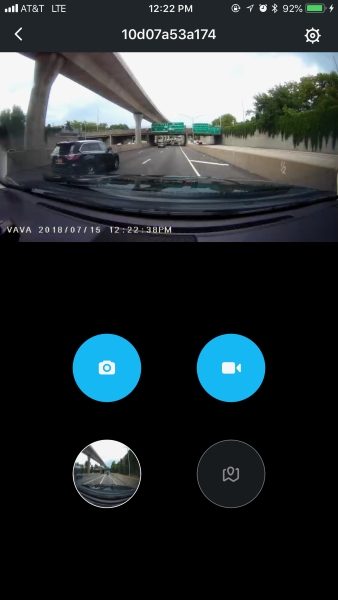
This screenshot has width=338, height=600. What are the coordinates of `pillar` in the screenshot? It's located at (39, 114), (138, 118).